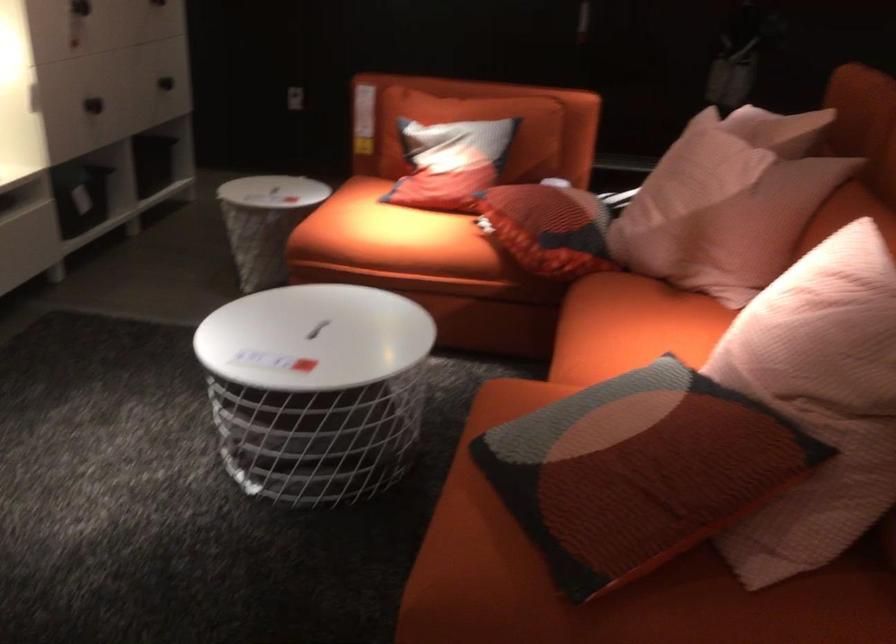
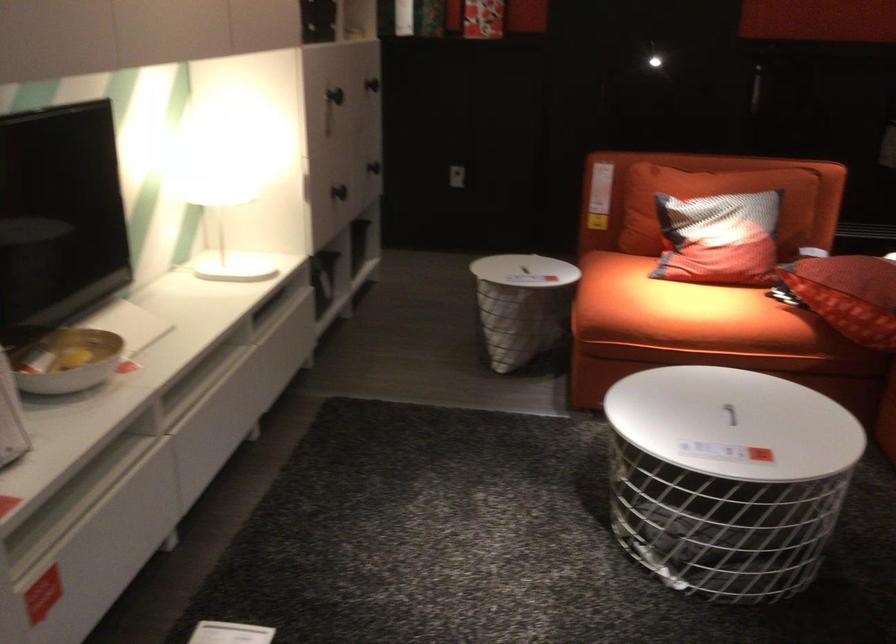
The point at (341, 327) is marked in the first image. Where is the corresponding point in the second image?

(729, 413)